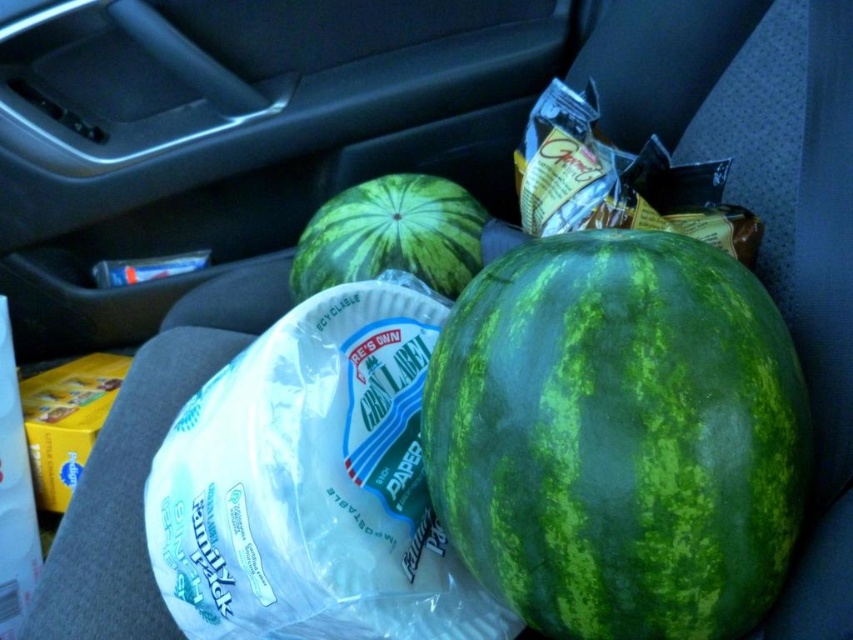
Question: Which point appears farthest from the camera in this image?

Choices:
 (A) (432, 195)
 (B) (550, 392)

Answer: (A)

Question: Does green textured melon at center appear over green textured watermelon at center?

Choices:
 (A) no
 (B) yes

Answer: (A)

Question: Is green textured melon at center thinner than green textured watermelon at center?

Choices:
 (A) yes
 (B) no

Answer: (A)

Question: Is green textured melon at center positioned at the back of green textured watermelon at center?

Choices:
 (A) yes
 (B) no

Answer: (B)